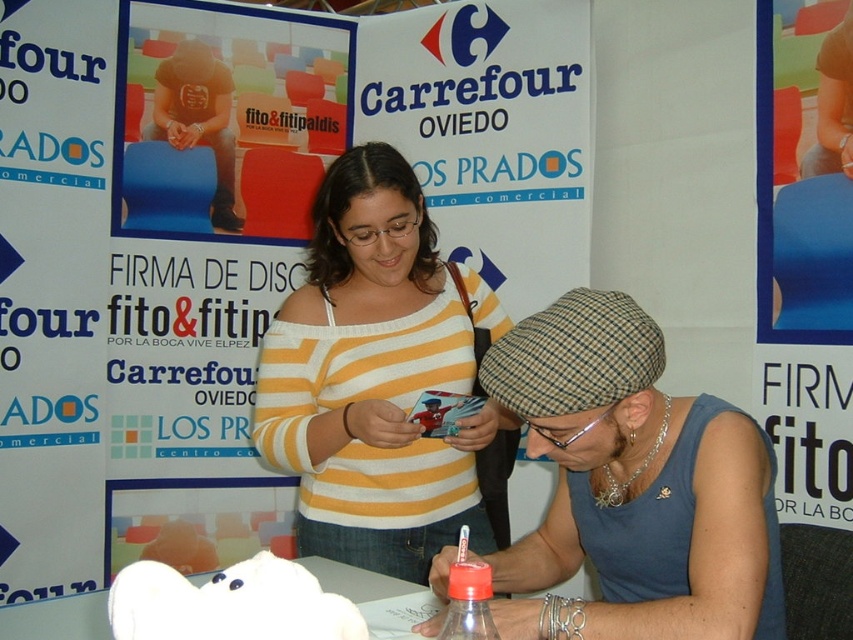
Question: Which object is the farthest from the striped cotton shirt at center?

Choices:
 (A) yellow/white striped sweater at center
 (B) white matte piggy bank at lower center
 (C) translucent plastic bottle at lower center

Answer: (A)

Question: Does white matte piggy bank at lower center appear over translucent plastic bottle at lower center?

Choices:
 (A) no
 (B) yes

Answer: (B)

Question: Is striped cotton shirt at center to the left of white matte piggy bank at lower center from the viewer's perspective?

Choices:
 (A) yes
 (B) no

Answer: (B)

Question: Does striped cotton shirt at center have a smaller size compared to white matte piggy bank at lower center?

Choices:
 (A) yes
 (B) no

Answer: (B)

Question: Which point is farther from the camera taking this photo?

Choices:
 (A) tap(352, 317)
 (B) tap(453, 627)
 (C) tap(202, 612)
 (D) tap(759, 604)

Answer: (A)

Question: Which point is closer to the camera?

Choices:
 (A) (485, 593)
 (B) (355, 262)

Answer: (A)